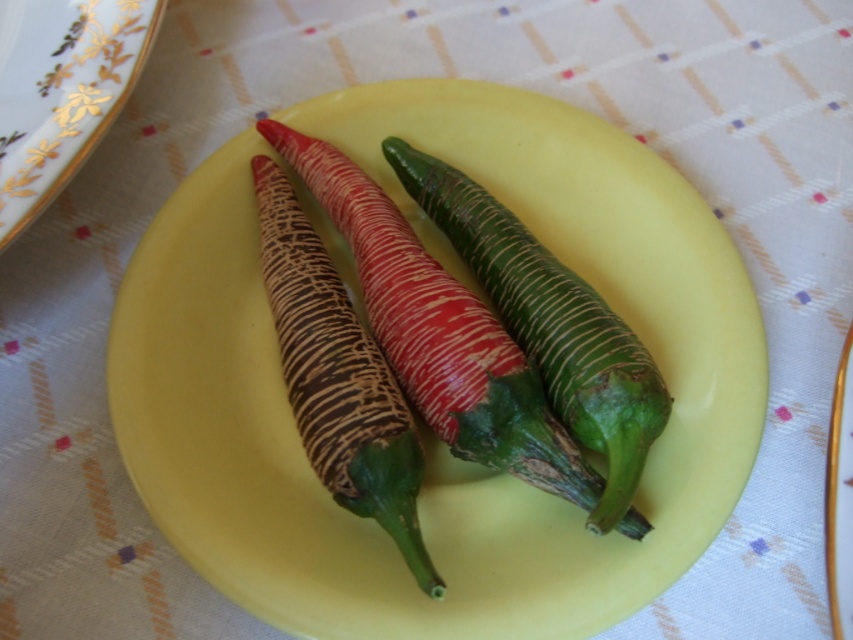
You are setting up a table for a spicy meal and need to place the textured brown chili pepper at center on the white porcelain plate at upper left. Can the chili pepper fit on the plate?

The textured brown chili pepper at center is larger in size than the white porcelain plate at upper left, so it cannot fit on the plate.

You are standing in a kitchen and want to grab the textured brown chili pepper at center. If your hand can reach up to 4 feet, will you be able to reach it?

The textured brown chili pepper at center is 3.99 feet away from the viewer, so yes, your hand can reach it since it is within the 4 feet limit.